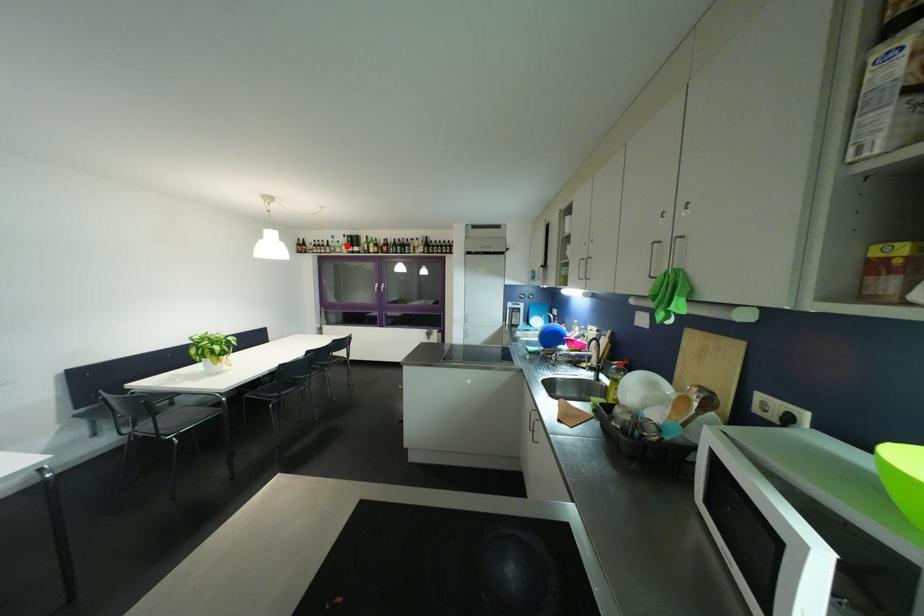
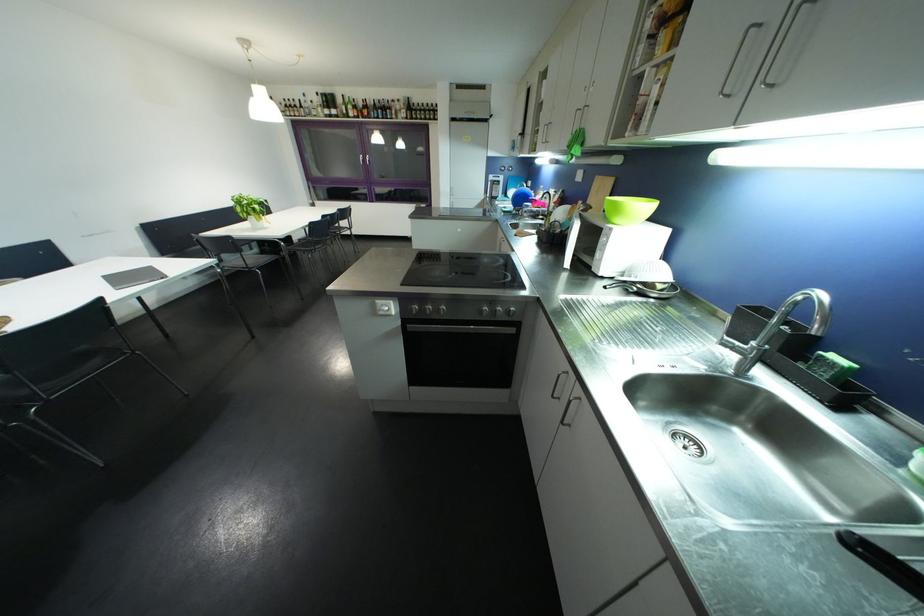
Where in the second image is the point corresponding to the highlighted location from the first image?

(322, 107)